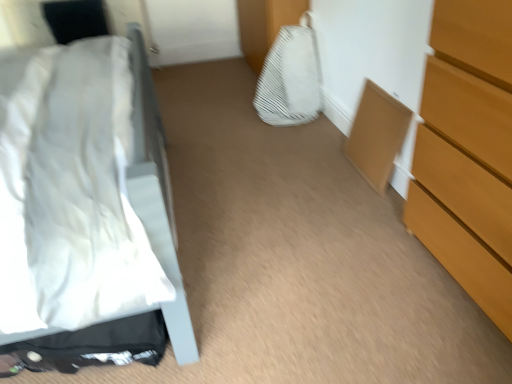
Question: From a real-world perspective, is white textured fabric at center physically below white matte bed at left?

Choices:
 (A) no
 (B) yes

Answer: (B)

Question: Does white textured fabric at center have a greater width compared to white matte bed at left?

Choices:
 (A) no
 (B) yes

Answer: (A)

Question: Is white textured fabric at center positioned far away from white matte bed at left?

Choices:
 (A) no
 (B) yes

Answer: (A)

Question: Considering the relative positions of white textured fabric at center and white matte bed at left in the image provided, is white textured fabric at center to the left of white matte bed at left from the viewer's perspective?

Choices:
 (A) yes
 (B) no

Answer: (B)

Question: From the image's perspective, is white textured fabric at center located above white matte bed at left?

Choices:
 (A) yes
 (B) no

Answer: (A)

Question: Is white matte bed at left to the left or to the right of white textured fabric at center in the image?

Choices:
 (A) left
 (B) right

Answer: (A)

Question: Considering the positions of white matte bed at left and white textured fabric at center in the image, is white matte bed at left wider or thinner than white textured fabric at center?

Choices:
 (A) wide
 (B) thin

Answer: (A)

Question: Is white matte bed at left inside or outside of white textured fabric at center?

Choices:
 (A) outside
 (B) inside

Answer: (A)

Question: Is point (159, 304) positioned closer to the camera than point (300, 99)?

Choices:
 (A) closer
 (B) farther

Answer: (A)

Question: From the image's perspective, is white matte bed at left above or below wooden chest of drawers at right?

Choices:
 (A) below
 (B) above

Answer: (B)

Question: In terms of size, does white matte bed at left appear bigger or smaller than wooden chest of drawers at right?

Choices:
 (A) big
 (B) small

Answer: (A)

Question: Relative to wooden chest of drawers at right, is white matte bed at left in front or behind?

Choices:
 (A) front
 (B) behind

Answer: (A)

Question: Would you say white matte bed at left is to the left or to the right of wooden chest of drawers at right in the picture?

Choices:
 (A) left
 (B) right

Answer: (A)

Question: Based on their positions, is white matte bed at left located to the left or right of matte wood cabinet at lower right?

Choices:
 (A) left
 (B) right

Answer: (A)

Question: Is point (147, 226) closer or farther from the camera than point (371, 173)?

Choices:
 (A) farther
 (B) closer

Answer: (B)